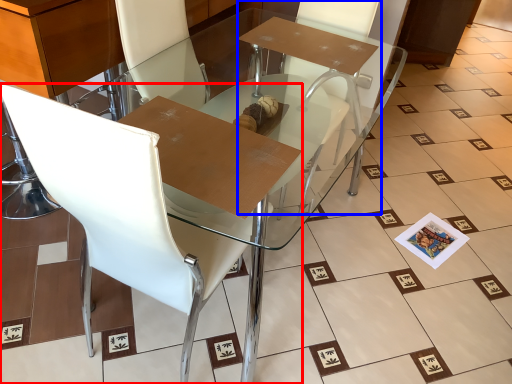
Question: Among these objects, which one is nearest to the camera, chair (highlighted by a red box) or armchair (highlighted by a blue box)?

Choices:
 (A) chair
 (B) armchair

Answer: (A)